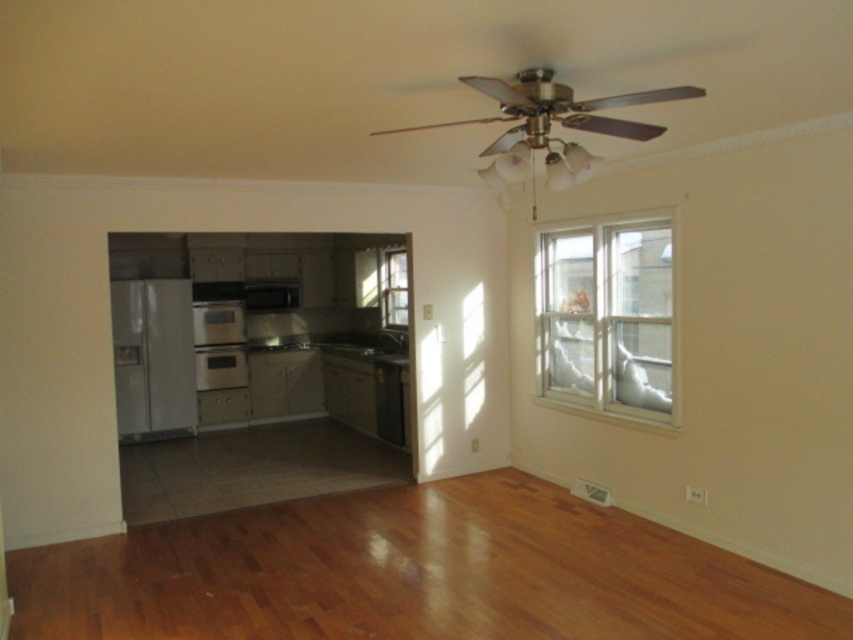
Question: Where is white glass window at upper right located in relation to clear glass window at center in the image?

Choices:
 (A) left
 (B) right

Answer: (B)

Question: Among these objects, which one is farthest from the camera?

Choices:
 (A) white glossy refrigerator at left
 (B) white glass window at upper right
 (C) black matte dishwasher at lower center
 (D) clear glass window at center

Answer: (D)

Question: Which point is farther from the camera taking this photo?

Choices:
 (A) (645, 337)
 (B) (386, 417)
 (C) (381, 316)
 (D) (160, 330)

Answer: (C)

Question: Based on their relative distances, which object is nearer to the black matte dishwasher at lower center?

Choices:
 (A) white glass window at upper right
 (B) white glossy refrigerator at left

Answer: (A)

Question: Can you confirm if white glass window at upper right is positioned above white glossy refrigerator at left?

Choices:
 (A) no
 (B) yes

Answer: (B)

Question: Is white glass window at upper right to the left of clear glass window at center from the viewer's perspective?

Choices:
 (A) yes
 (B) no

Answer: (B)